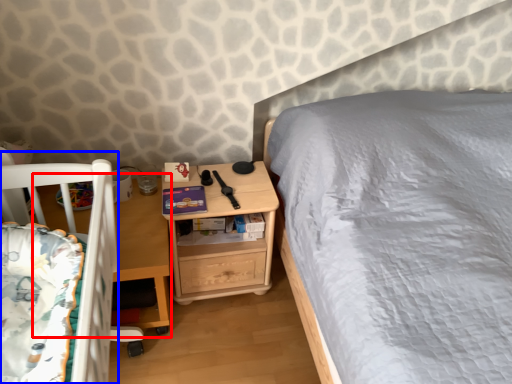
Question: Which object is closer to the camera taking this photo, table (highlighted by a red box) or infant bed (highlighted by a blue box)?

Choices:
 (A) table
 (B) infant bed

Answer: (B)